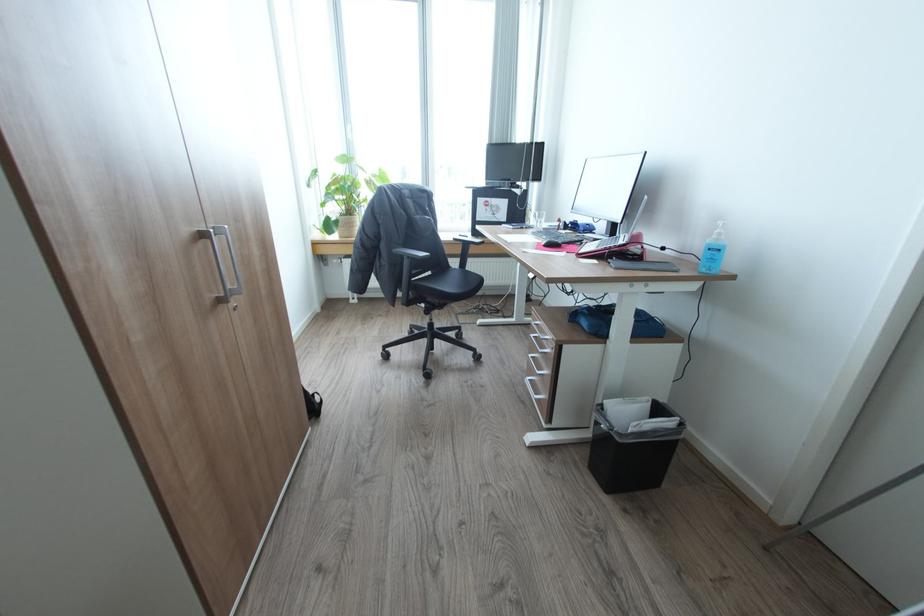
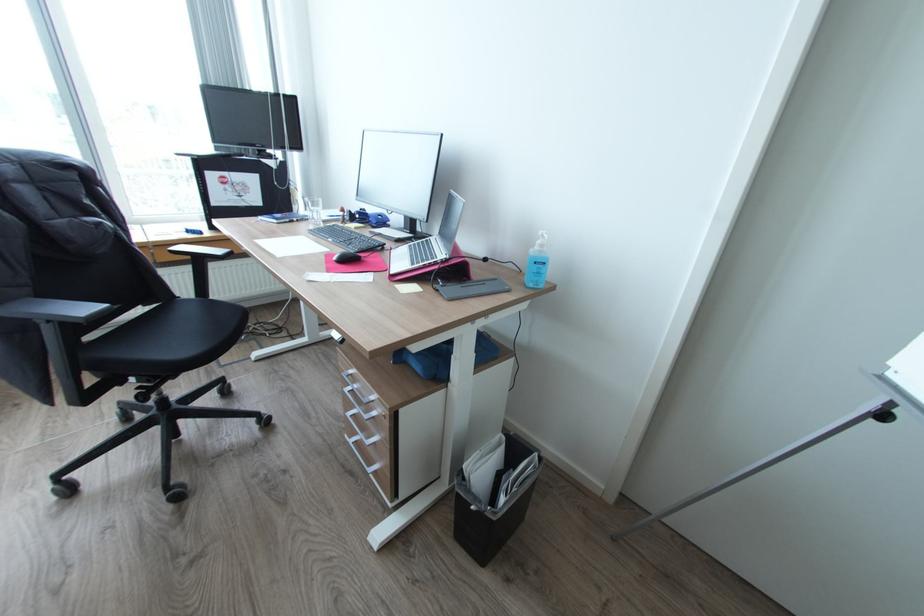
The point at [723,233] is marked in the first image. Where is the corresponding point in the second image?

(545, 245)